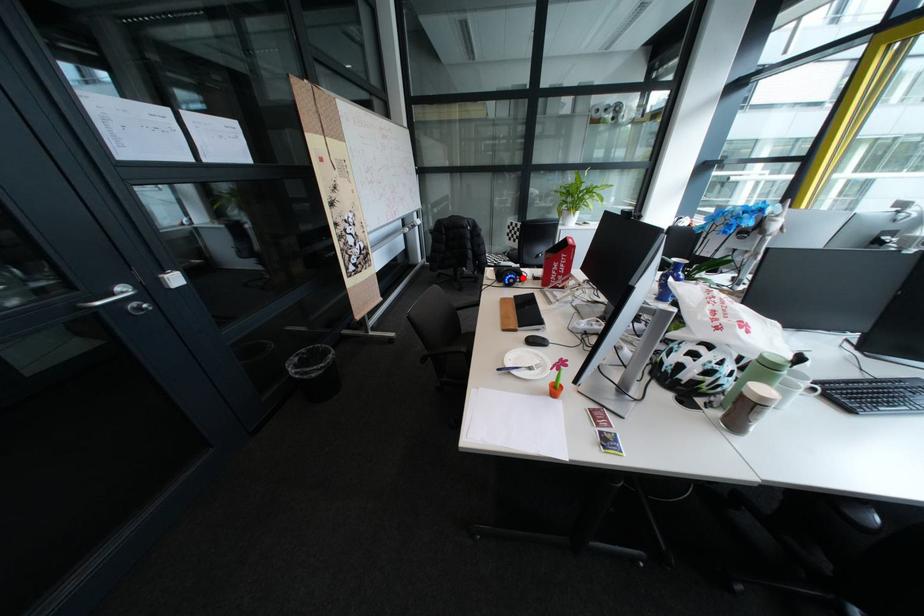
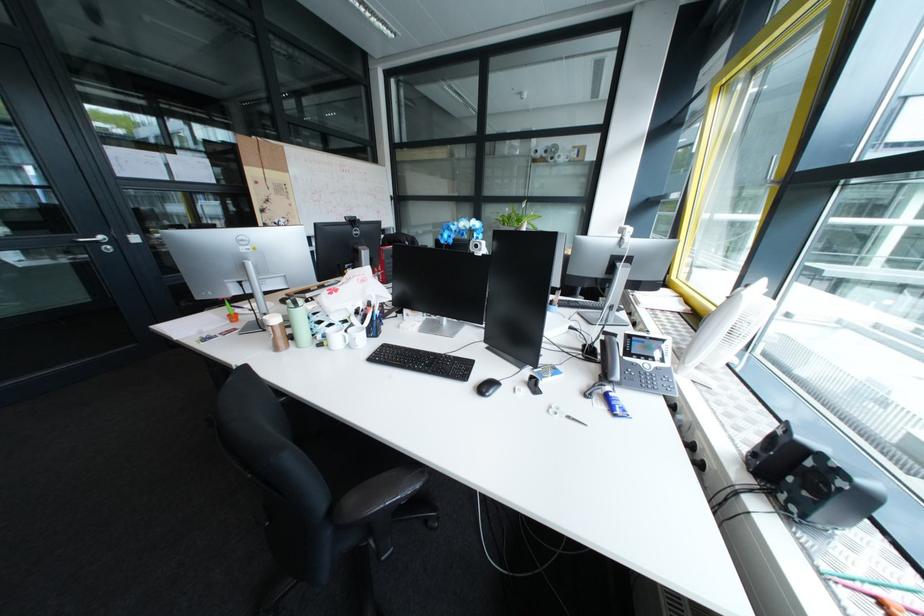
Question: I am providing you with two images of the same scene from different viewpoints. A red point is marked on the first image. Is the red point's position out of view in image 2?

Choices:
 (A) Yes
 (B) No

Answer: (A)